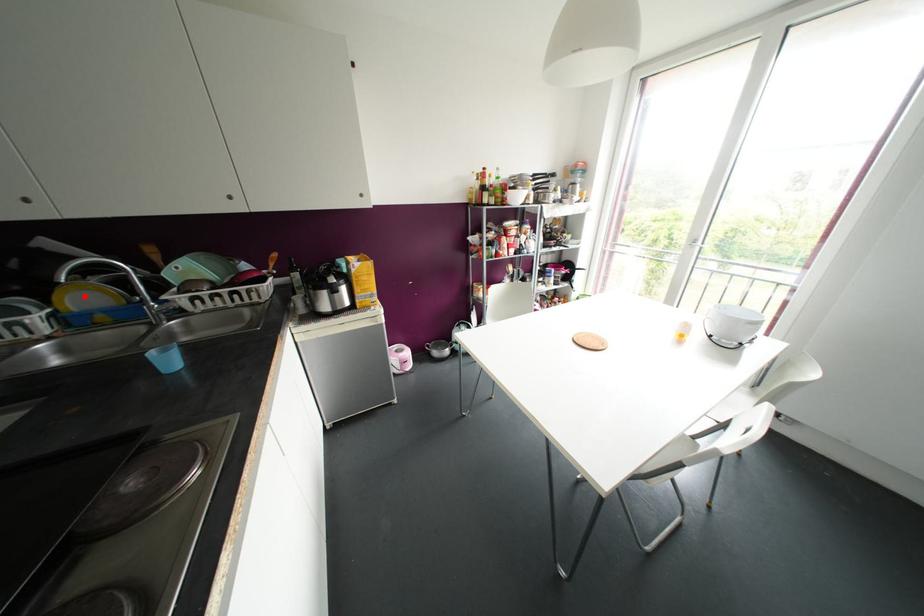
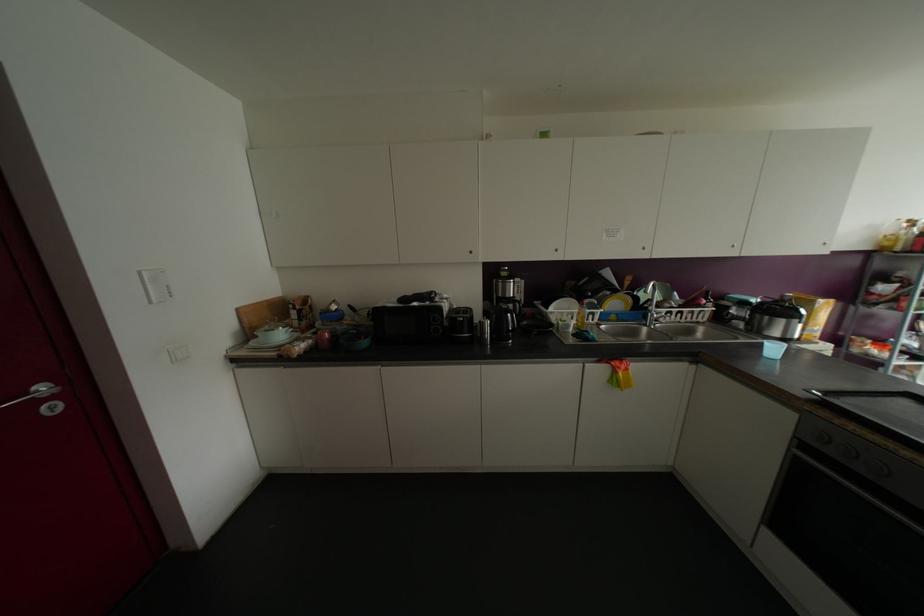
Locate, in the second image, the point that corresponds to the highlighted location in the first image.

(614, 302)